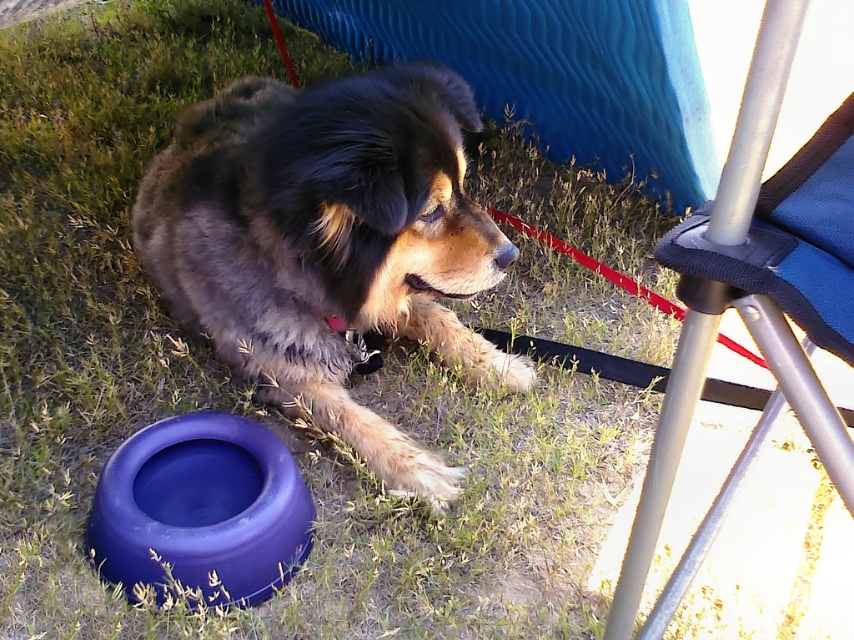
Based on the scene description, what are the coordinates of the fuzzy brown dog at center?

The coordinates of the fuzzy brown dog at center are at point (328,243).

You are setting up a campsite and need to ensure there is enough space between the fuzzy brown dog at center and the metallic silver folding chair at right for a small cooler. Based on their sizes, do you think the space between them is sufficient?

The fuzzy brown dog at center might be wider than the metallic silver folding chair at right, so the space between them may not be sufficient for placing a small cooler. You should check the exact dimensions before deciding.